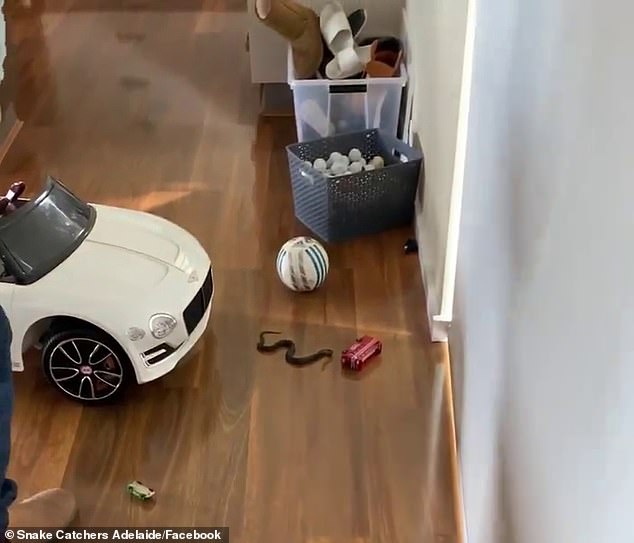
Find the location of a particular element. Image resolution: width=634 pixels, height=543 pixels. wood floor is located at coordinates (247, 238).